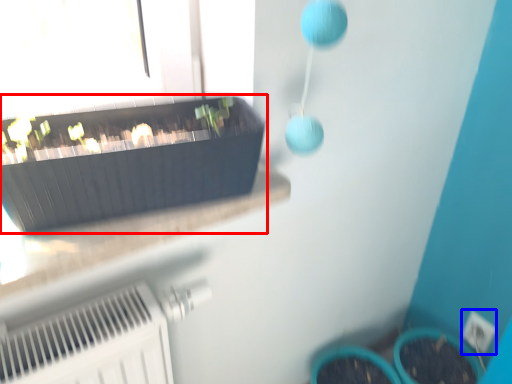
Question: Which point is closer to the camera, flowerpot (highlighted by a red box) or electric outlet (highlighted by a blue box)?

Choices:
 (A) flowerpot
 (B) electric outlet

Answer: (A)